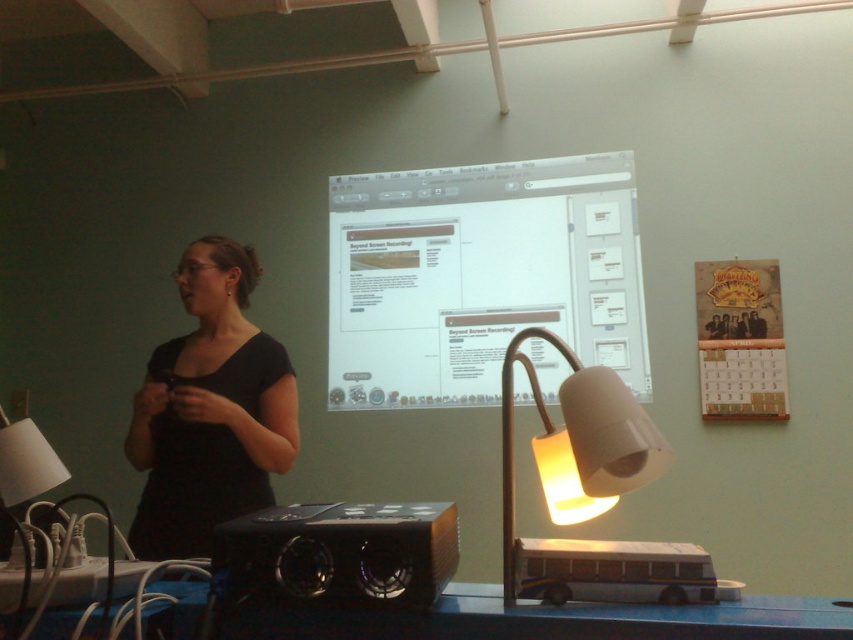
Question: Does black matte shirt at left have a larger size compared to matte white lamp at lower left?

Choices:
 (A) yes
 (B) no

Answer: (A)

Question: Based on their relative distances, which object is farther from the blue plastic table at lower center?

Choices:
 (A) matte white lamp at center
 (B) white glossy screen at center

Answer: (B)

Question: Can you confirm if blue plastic table at lower center is positioned above matte white lamp at center?

Choices:
 (A) yes
 (B) no

Answer: (B)

Question: Which point is farther to the camera?

Choices:
 (A) black matte shirt at left
 (B) white glossy screen at center
 (C) matte white lamp at center
 (D) blue plastic table at lower center

Answer: (B)

Question: Is black matte shirt at left further to camera compared to matte white lamp at center?

Choices:
 (A) yes
 (B) no

Answer: (A)

Question: Among these points, which one is farthest from the camera?

Choices:
 (A) (245, 620)
 (B) (392, 573)

Answer: (A)